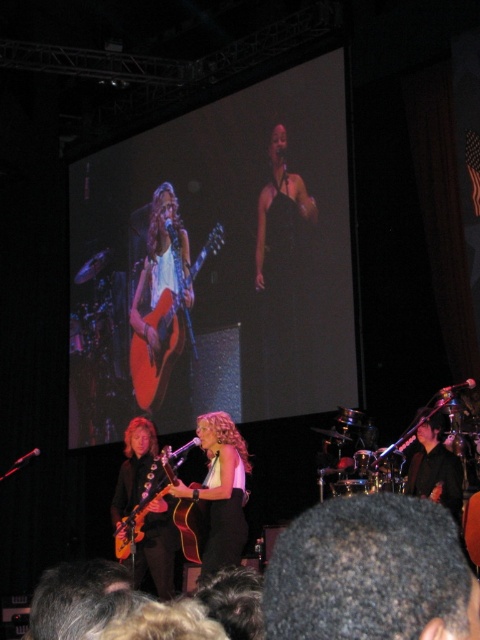
Question: Can you confirm if dark curly hair at center is positioned above shiny gold guitar at center?

Choices:
 (A) yes
 (B) no

Answer: (A)

Question: Is shiny gold guitar at center above light brown wood guitar at center?

Choices:
 (A) yes
 (B) no

Answer: (A)

Question: Which object is closer to the camera taking this photo?

Choices:
 (A) shiny gold guitar at center
 (B) dark curly hair at center
 (C) orange matte acoustic guitar at center

Answer: (B)

Question: Does black leather jacket at center lie in front of light brown wood guitar at center?

Choices:
 (A) yes
 (B) no

Answer: (A)

Question: Which object is closer to the camera taking this photo?

Choices:
 (A) shiny gold guitar at center
 (B) dark curly hair at center

Answer: (B)

Question: Based on their relative distances, which object is farther from the dark curly hair at center?

Choices:
 (A) black leather jacket at center
 (B) shiny gold guitar at center

Answer: (B)